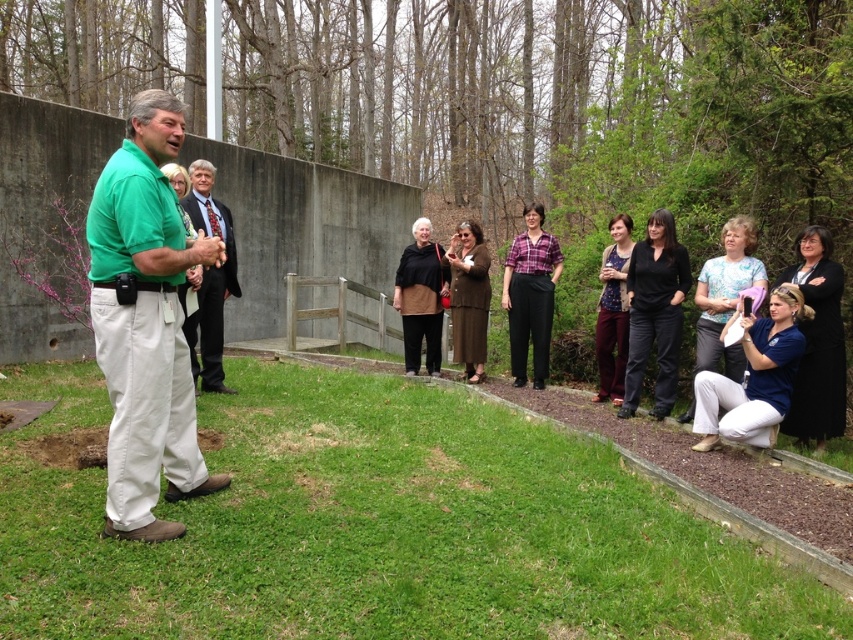
Is black matte pants at center behind patterned fabric dress at center?

No, it is in front of patterned fabric dress at center.

Is black matte pants at center thinner than patterned fabric dress at center?

No, black matte pants at center is not thinner than patterned fabric dress at center.

Where is `black matte pants at center`? black matte pants at center is located at coordinates (654, 312).

From the picture: Which is below, black matte pants at center or matte black jacket at center?

black matte pants at center is below.

Can you confirm if black matte pants at center is bigger than matte black jacket at center?

No.

Does point (668, 236) come in front of point (426, 257)?

Yes.

Locate an element on the screen. Image resolution: width=853 pixels, height=640 pixels. black matte pants at center is located at coordinates (654, 312).

Does plaid fabric shirt at center lie in front of matte black jacket at center?

Yes, plaid fabric shirt at center is closer to the viewer.

In the scene shown: Does plaid fabric shirt at center appear over matte black jacket at center?

Yes.

Between point (552, 310) and point (433, 301), which one is positioned behind?

The point (433, 301) is more distant.

Locate an element on the screen. plaid fabric shirt at center is located at coordinates (531, 294).